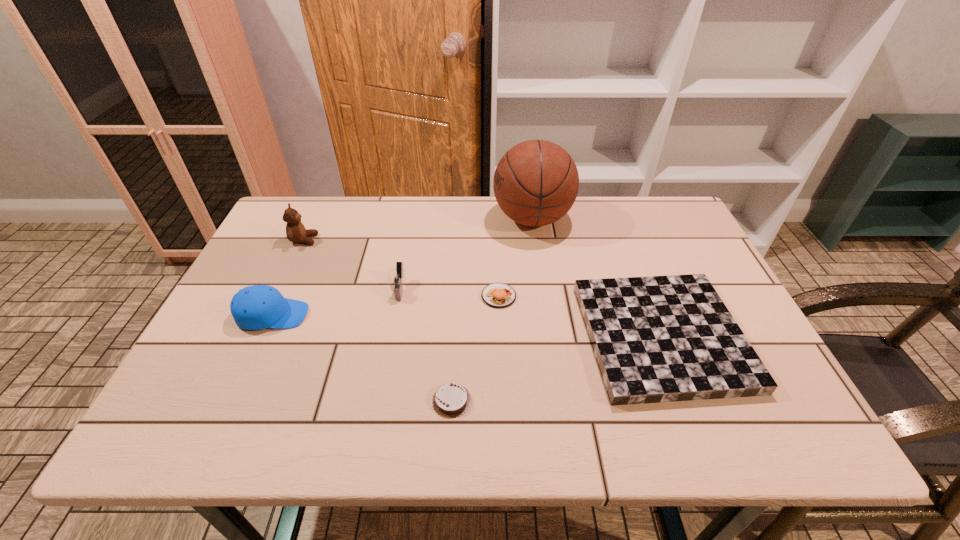
You are a GUI agent. You are given a task and a screenshot of the screen. Output one action in this format:
    pyautogui.click(x=<x>, y=<y>)
    Task: Click on the tallest object
    
    Given the screenshot: What is the action you would take?
    pyautogui.click(x=536, y=182)

Find the location of `the sixth shortest object`. the sixth shortest object is located at coordinates (295, 231).

You are a GUI agent. You are given a task and a screenshot of the screen. Output one action in this format:
    pyautogui.click(x=<x>, y=<y>)
    Task: Click on the fifth object from right to left
    The width and height of the screenshot is (960, 540).
    Given the screenshot: What is the action you would take?
    pyautogui.click(x=397, y=275)

The height and width of the screenshot is (540, 960). I want to click on cap, so (256, 307).

You are a GUI agent. You are given a task and a screenshot of the screen. Output one action in this format:
    pyautogui.click(x=<x>, y=<y>)
    Task: Click on the patty
    
    Given the screenshot: What is the action you would take?
    pyautogui.click(x=498, y=295)

Locate an element on the screen. the second shortest object is located at coordinates (656, 339).

This screenshot has height=540, width=960. Find the location of `the shortest object`. the shortest object is located at coordinates (451, 400).

The height and width of the screenshot is (540, 960). What are the coordinates of `chocolate cake` in the screenshot? It's located at (451, 400).

Locate an element on the screen. This screenshot has width=960, height=540. vacant space situated on the side with brand label of the tallest object is located at coordinates (389, 219).

The width and height of the screenshot is (960, 540). What are the coordinates of `free region located 0.210m on the side with brand label of the tallest object` in the screenshot? It's located at (426, 219).